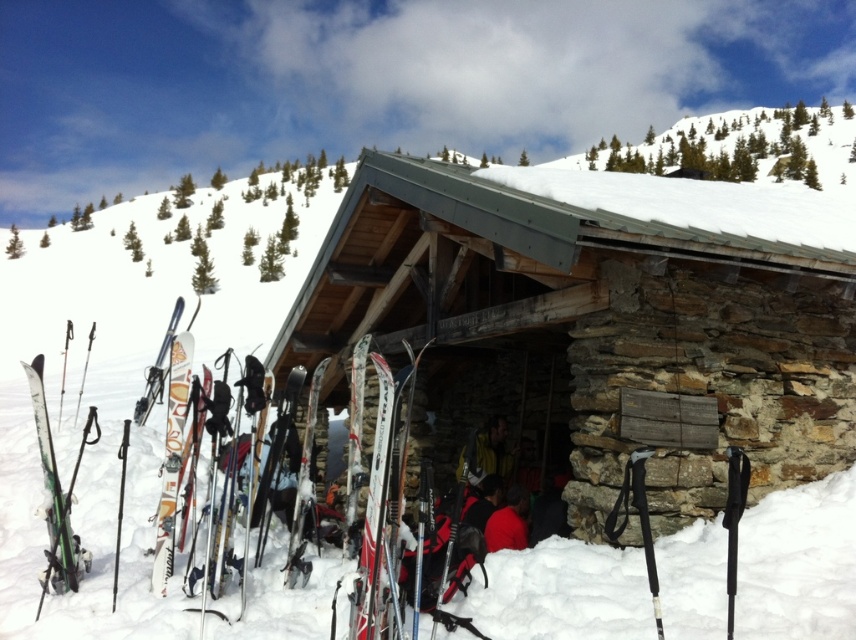
Is white glossy skis at center bigger than green matte skis at left?

No.

Who is shorter, white glossy skis at center or green matte skis at left?

white glossy skis at center is shorter.

Who is more distant from viewer, (x=352, y=596) or (x=34, y=394)?

The point (x=34, y=394) is more distant.

You are a GUI agent. You are given a task and a screenshot of the screen. Output one action in this format:
    pyautogui.click(x=<x>, y=<y>)
    Task: Click on the white glossy skis at center
    This screenshot has height=640, width=856.
    Given the screenshot: What is the action you would take?
    pyautogui.click(x=373, y=515)

Who is taller, white glossy skis at center or shiny metallic ski at center?

With more height is white glossy skis at center.

From the picture: Who is positioned more to the right, white glossy skis at center or shiny metallic ski at center?

white glossy skis at center

The width and height of the screenshot is (856, 640). Describe the element at coordinates (373, 515) in the screenshot. I see `white glossy skis at center` at that location.

You are a GUI agent. You are given a task and a screenshot of the screen. Output one action in this format:
    pyautogui.click(x=<x>, y=<y>)
    Task: Click on the white glossy skis at center
    Image resolution: width=856 pixels, height=640 pixels.
    Given the screenshot: What is the action you would take?
    pyautogui.click(x=373, y=515)

Between point (185, 362) and point (522, 499), which one is positioned behind?

Positioned behind is point (522, 499).

You are a GUI agent. You are given a task and a screenshot of the screen. Output one action in this format:
    pyautogui.click(x=<x>, y=<y>)
    Task: Click on the matte orange ski at left
    The height and width of the screenshot is (640, 856).
    Given the screenshot: What is the action you would take?
    pyautogui.click(x=171, y=458)